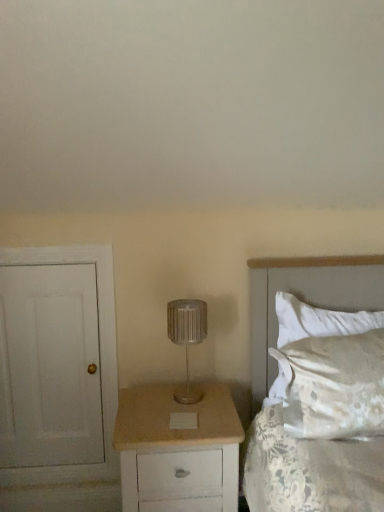
Identify the location of free space to the left of silver metallic lamp at center. The height and width of the screenshot is (512, 384). (151, 400).